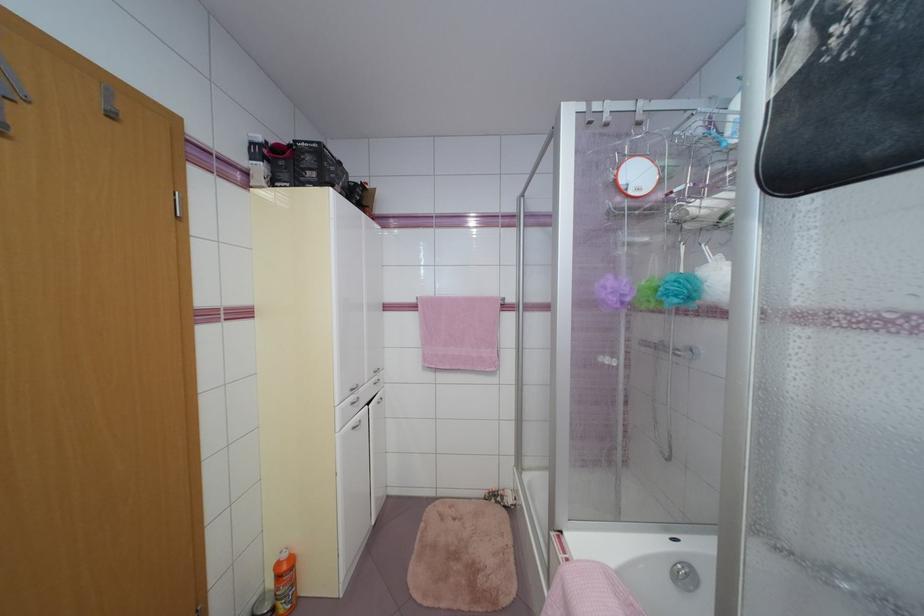
The height and width of the screenshot is (616, 924). What do you see at coordinates (671, 349) in the screenshot?
I see `a shower faucet handle` at bounding box center [671, 349].